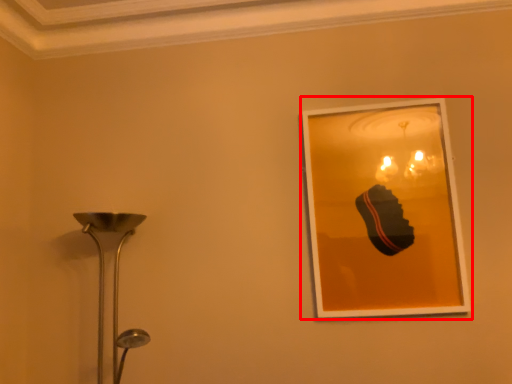
Question: From the image, what is the correct spatial relationship of picture frame (annotated by the red box) in relation to lamp?

Choices:
 (A) right
 (B) left

Answer: (A)